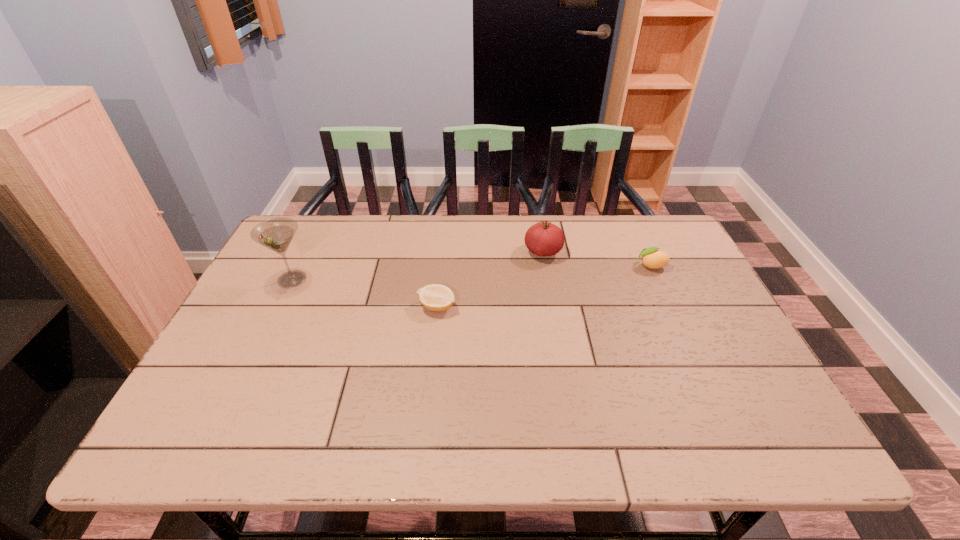
Find the location of `the leftmost object`. the leftmost object is located at coordinates (276, 234).

Find the location of a particular element. the tallest object is located at coordinates pyautogui.click(x=276, y=234).

Where is `the third shortest object`? the third shortest object is located at coordinates (543, 238).

You are a GUI agent. You are given a task and a screenshot of the screen. Output one action in this format:
    pyautogui.click(x=<x>, y=<y>)
    Task: Click on the tomato
    
    Given the screenshot: What is the action you would take?
    pyautogui.click(x=543, y=238)

The width and height of the screenshot is (960, 540). I want to click on the second shortest object, so click(x=653, y=258).

You are a GUI agent. You are given a task and a screenshot of the screen. Output one action in this format:
    pyautogui.click(x=<x>, y=<y>)
    Task: Click on the right lemon
    The image size is (960, 540).
    Given the screenshot: What is the action you would take?
    pyautogui.click(x=653, y=258)

The height and width of the screenshot is (540, 960). I want to click on the left lemon, so click(x=436, y=297).

Locate an element on the screen. This screenshot has width=960, height=540. the nearer lemon is located at coordinates (436, 297).

Locate an element on the screen. This screenshot has width=960, height=540. vacant region located on the front of the tallest object is located at coordinates (260, 345).

Where is `free space located 0.140m on the left of the second tallest object`? This screenshot has width=960, height=540. free space located 0.140m on the left of the second tallest object is located at coordinates [x=478, y=252].